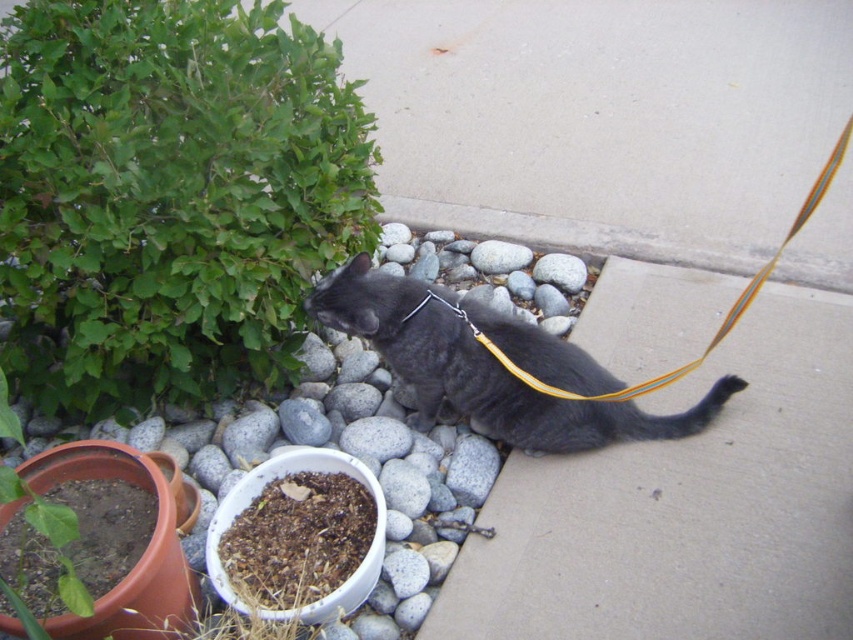
You are a gardener who wants to water the brown soil at lower left. The green leafy bush at upper left is in the way. Can you move the bush to the right to make space for watering?

The green leafy bush at upper left is already positioned to the left of the brown soil at lower left, so moving it further right would allow you to access the brown soil at lower left for watering.